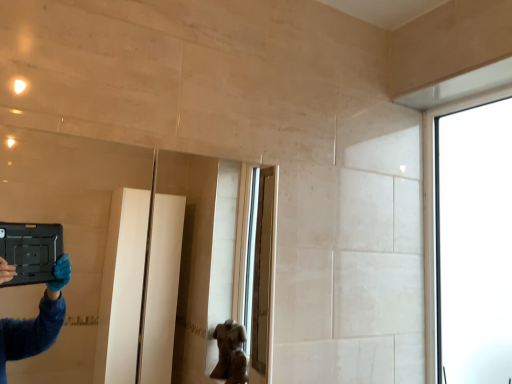
Question: From the image's perspective, is transparent glass window at upper right above or below clear glass mirror at upper left?

Choices:
 (A) below
 (B) above

Answer: (B)

Question: Considering the positions of point pos(488,104) and point pos(9,205), is point pos(488,104) closer or farther from the camera than point pos(9,205)?

Choices:
 (A) farther
 (B) closer

Answer: (B)

Question: Considering the positions of transparent glass window at upper right and clear glass mirror at upper left in the image, is transparent glass window at upper right wider or thinner than clear glass mirror at upper left?

Choices:
 (A) wide
 (B) thin

Answer: (B)

Question: In terms of size, does clear glass mirror at upper left appear bigger or smaller than transparent glass window at upper right?

Choices:
 (A) big
 (B) small

Answer: (A)

Question: Is point (25, 362) closer or farther from the camera than point (435, 170)?

Choices:
 (A) closer
 (B) farther

Answer: (B)

Question: Relative to transparent glass window at upper right, is clear glass mirror at upper left in front or behind?

Choices:
 (A) behind
 (B) front

Answer: (B)

Question: Do you think clear glass mirror at upper left is within transparent glass window at upper right, or outside of it?

Choices:
 (A) inside
 (B) outside

Answer: (B)